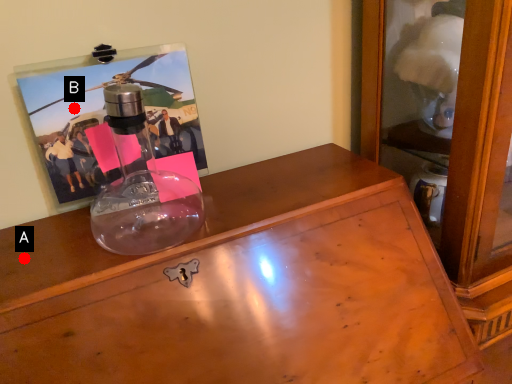
Question: Two points are circled on the image, labeled by A and B beside each circle. Among these points, which one is farthest from the camera?

Choices:
 (A) A is further
 (B) B is further

Answer: (B)